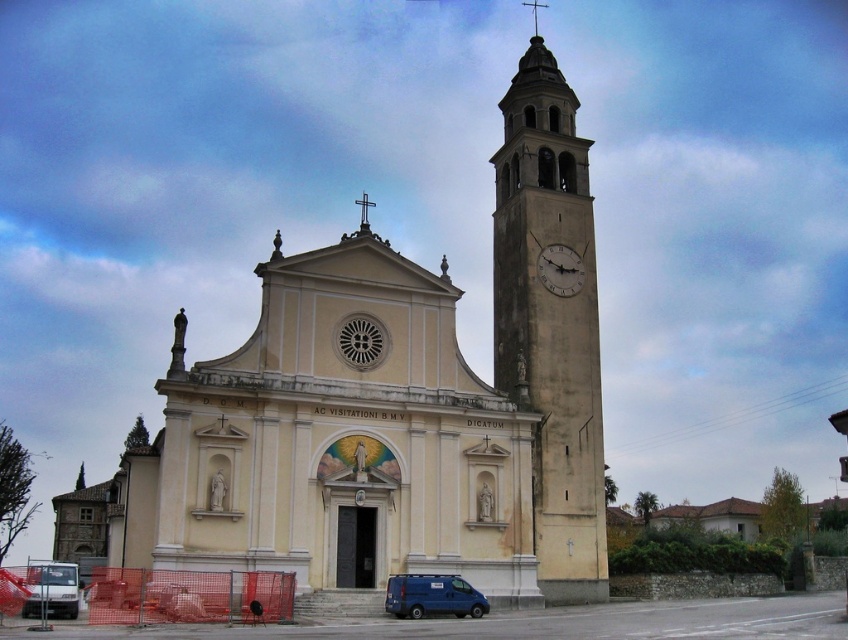
Question: Which point is closer to the camera?

Choices:
 (A) blue matte van at lower center
 (B) white matte van at lower left
 (C) matte gray clock at upper right
 (D) beige stone church at center

Answer: (B)

Question: Can you confirm if beige stone church at center is thinner than light beige stone clock tower at right?

Choices:
 (A) yes
 (B) no

Answer: (B)

Question: Based on their relative distances, which object is farther from the white matte van at lower left?

Choices:
 (A) light beige stone clock tower at right
 (B) blue matte van at lower center
 (C) beige stone church at center

Answer: (A)

Question: Is beige stone church at center below blue matte van at lower center?

Choices:
 (A) no
 (B) yes

Answer: (A)

Question: Can you confirm if white matte van at lower left is smaller than matte gray clock at upper right?

Choices:
 (A) no
 (B) yes

Answer: (A)

Question: Which is nearer to the beige stone church at center?

Choices:
 (A) blue matte van at lower center
 (B) white matte van at lower left
 (C) matte gray clock at upper right

Answer: (C)